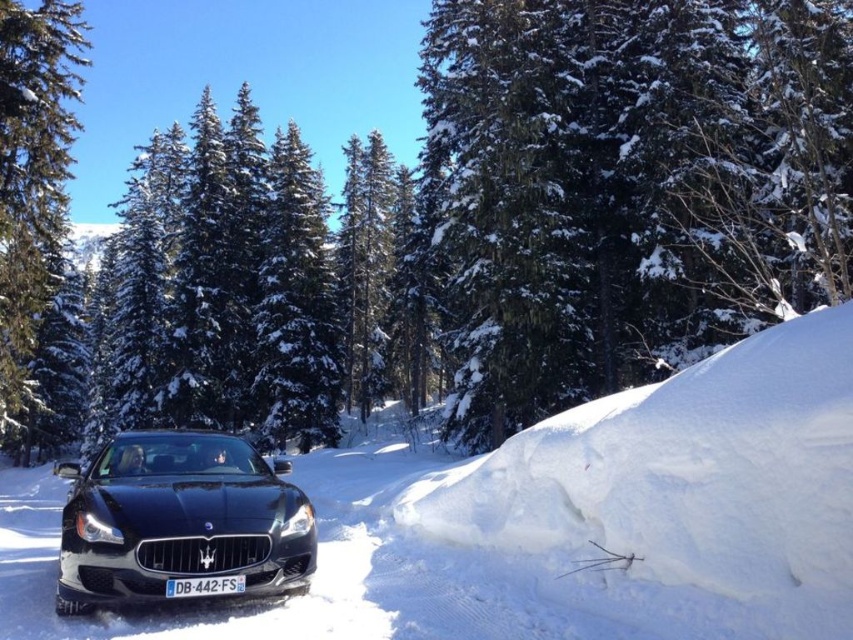
You are a delivery person trying to deliver a package to the glossy black car at center. The package must be placed exactly on the white plastic license plate at center. Given that the delivery robot can only move 2.5 meters, will it be able to reach the license plate from the car?

The glossy black car at center is 3.03 meters away from the white plastic license plate at center. Since the delivery robot can only move 2.5 meters, it cannot reach the license plate from the car.

From the picture: You are a delivery drone flying over a snow forest and need to land near the glossy black car at center. According to the coordinates provided, where should you position yourself relative to the car to ensure a safe landing?

The glossy black car at center is located at point (178, 518). To ensure a safe landing, position yourself slightly to the right and above the car based on the coordinates provided.

You are driving a car and want to park it in a spot where there is white fluffy snow at center and glossy black car at center. Which object should you avoid hitting when parking?

You should avoid hitting the white fluffy snow at center because it is in front of the glossy black car at center, meaning it is closer to your current position.